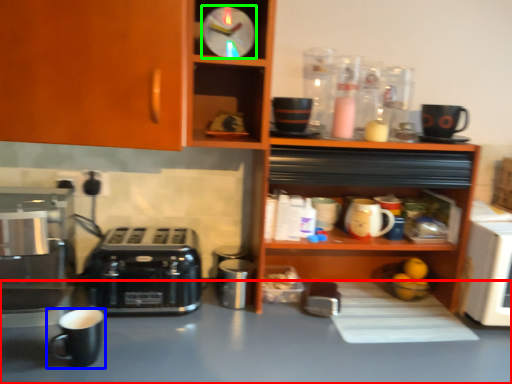
Question: Which object is the closest to the table (highlighted by a red box)? Choose among these: coffee cup (highlighted by a blue box) or clock (highlighted by a green box).

Choices:
 (A) coffee cup
 (B) clock

Answer: (A)